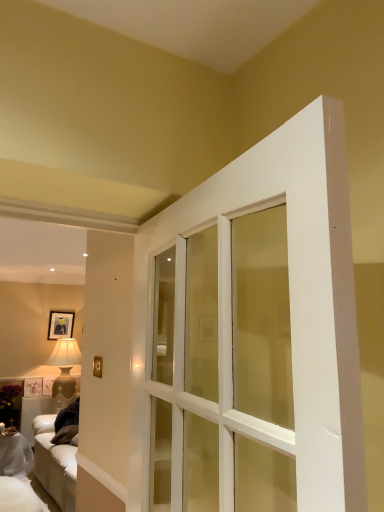
Question: Is the position of matte black picture frame at upper left less distant than that of matte beige lamp at left?

Choices:
 (A) no
 (B) yes

Answer: (A)

Question: Considering the relative sizes of matte black picture frame at upper left and matte beige lamp at left in the image provided, is matte black picture frame at upper left taller than matte beige lamp at left?

Choices:
 (A) no
 (B) yes

Answer: (A)

Question: Can we say matte black picture frame at upper left lies outside matte beige lamp at left?

Choices:
 (A) no
 (B) yes

Answer: (B)

Question: Can you confirm if matte black picture frame at upper left is shorter than matte beige lamp at left?

Choices:
 (A) no
 (B) yes

Answer: (B)

Question: Is matte black picture frame at upper left surrounding matte beige lamp at left?

Choices:
 (A) no
 (B) yes

Answer: (A)

Question: Does matte black picture frame at upper left have a lesser width compared to matte beige lamp at left?

Choices:
 (A) yes
 (B) no

Answer: (A)

Question: Considering the relative positions of white fabric couch at lower left and matte beige lamp at left in the image provided, is white fabric couch at lower left to the right of matte beige lamp at left from the viewer's perspective?

Choices:
 (A) no
 (B) yes

Answer: (A)

Question: From a real-world perspective, is white fabric couch at lower left beneath matte beige lamp at left?

Choices:
 (A) no
 (B) yes

Answer: (B)

Question: Considering the relative positions of white fabric couch at lower left and matte beige lamp at left in the image provided, is white fabric couch at lower left in front of matte beige lamp at left?

Choices:
 (A) yes
 (B) no

Answer: (A)

Question: Is white fabric couch at lower left oriented towards matte beige lamp at left?

Choices:
 (A) no
 (B) yes

Answer: (A)

Question: Is white fabric couch at lower left not close to matte beige lamp at left?

Choices:
 (A) no
 (B) yes

Answer: (A)

Question: Can you confirm if white fabric couch at lower left is shorter than matte beige lamp at left?

Choices:
 (A) no
 (B) yes

Answer: (B)

Question: Does matte beige lamp at left turn towards matte black picture frame at upper left?

Choices:
 (A) yes
 (B) no

Answer: (B)